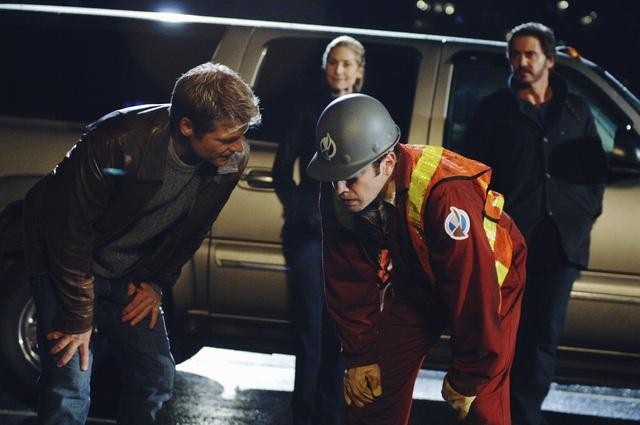
I want to click on door handle, so click(262, 176).